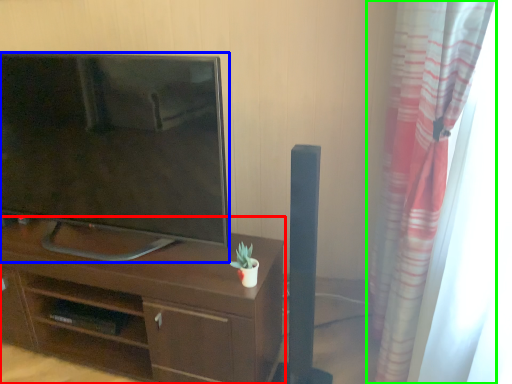
Question: Estimate the real-world distances between objects in this image. Which object is closer to desk (highlighted by a red box), television (highlighted by a blue box) or curtain (highlighted by a green box)?

Choices:
 (A) television
 (B) curtain

Answer: (A)